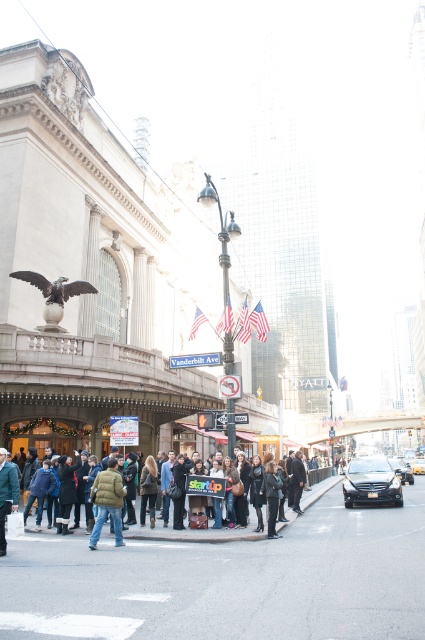
Question: Which point is farther from the camera taking this photo?

Choices:
 (A) (71, 288)
 (B) (17, 499)
 (C) (399, 467)

Answer: (C)

Question: Which of these objects is positioned farthest from the dark gray fabric crowd at center?

Choices:
 (A) black metallic car at center
 (B) yellow rubber taxi at center
 (C) shiny bronze eagle at center

Answer: (B)

Question: Does dark gray asphalt at lower center appear under yellow rubber taxi at center?

Choices:
 (A) no
 (B) yes

Answer: (A)

Question: Can you confirm if dark gray fabric crowd at center is positioned below shiny black sedan at center?

Choices:
 (A) yes
 (B) no

Answer: (B)

Question: Which object appears closest to the camera in this image?

Choices:
 (A) dark blue jacket at lower left
 (B) dark gray asphalt at lower center
 (C) shiny black sedan at center
 (D) khaki wool jacket at lower left

Answer: (B)

Question: Does black metallic car at center have a greater width compared to yellow rubber taxi at center?

Choices:
 (A) yes
 (B) no

Answer: (B)